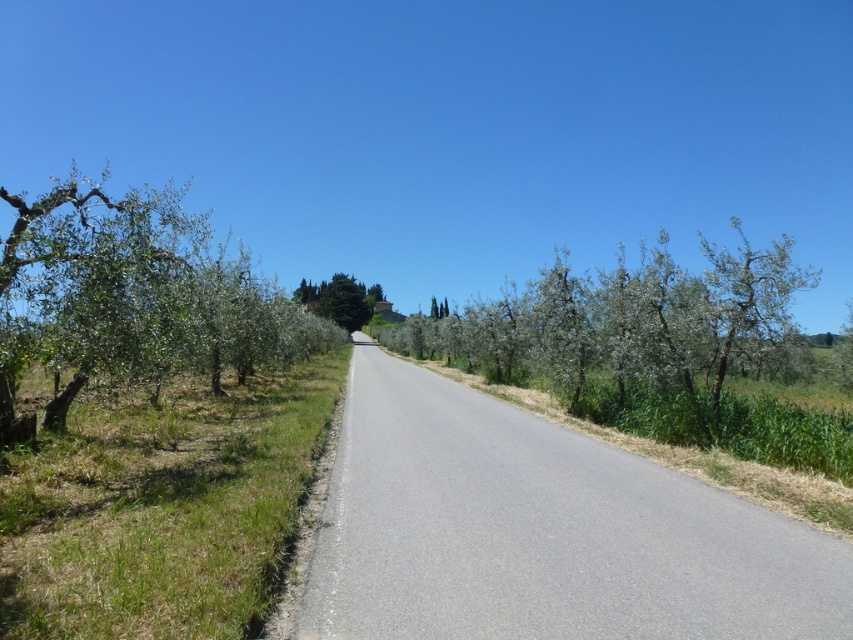
Question: Which of these objects is positioned closest to the green leafy trees at center?

Choices:
 (A) green leafy tree at center
 (B) green leafy tree at left

Answer: (A)

Question: Which object is positioned closest to the green leafy tree at center?

Choices:
 (A) green leafy trees at center
 (B) green leafy tree at left

Answer: (B)

Question: Which point appears closest to the camera in this image?

Choices:
 (A) (432, 333)
 (B) (368, 310)
 (C) (318, 339)

Answer: (C)

Question: Considering the relative positions of green leafy trees at center and green leafy tree at left in the image provided, where is green leafy trees at center located with respect to green leafy tree at left?

Choices:
 (A) left
 (B) right

Answer: (B)

Question: Does green leafy trees at center have a greater width compared to green leafy tree at center?

Choices:
 (A) yes
 (B) no

Answer: (A)

Question: Does green leafy trees at center appear over green leafy tree at center?

Choices:
 (A) no
 (B) yes

Answer: (A)